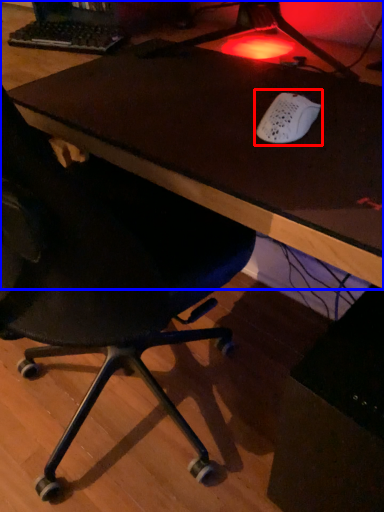
Question: Among these objects, which one is nearest to the camera, mouse (highlighted by a red box) or table (highlighted by a blue box)?

Choices:
 (A) mouse
 (B) table

Answer: (B)